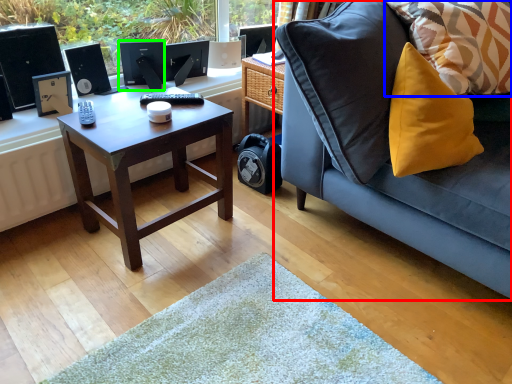
Question: Considering the real-world distances, which object is farthest from studio couch (highlighted by a red box)? pillow (highlighted by a blue box) or computer monitor (highlighted by a green box)?

Choices:
 (A) pillow
 (B) computer monitor

Answer: (B)